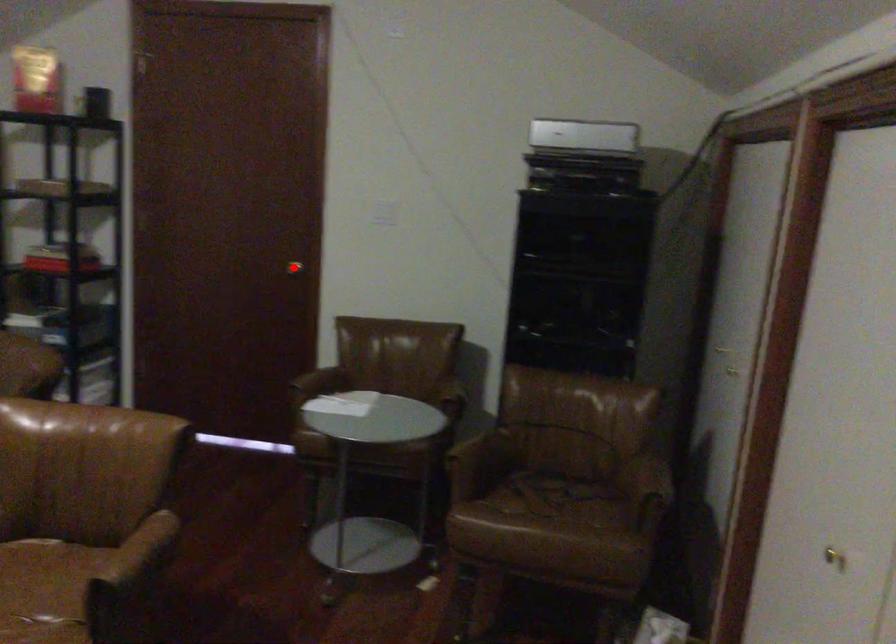
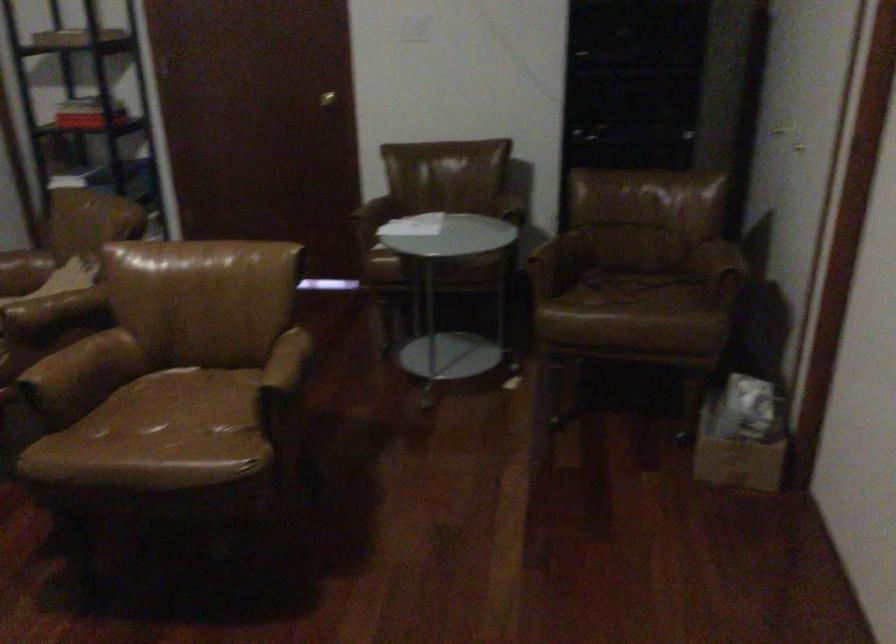
The point at the highlighted location is marked in the first image. Where is the corresponding point in the second image?

(326, 99)